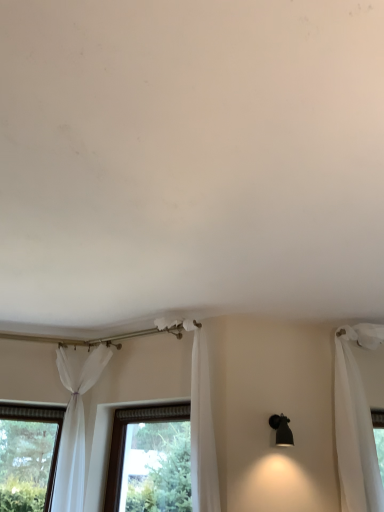
Question: Is white sheer curtain at center, positioned as the 1th curtain in right-to-left order, positioned with its back to sheer white curtain at lower left, which appears as the first curtain when viewed from the left?

Choices:
 (A) no
 (B) yes

Answer: (A)

Question: From a real-world perspective, is white sheer curtain at center, which is counted as the 2th curtain, starting from the left, positioned over sheer white curtain at lower left, arranged as the 2th curtain when viewed from the right, based on gravity?

Choices:
 (A) no
 (B) yes

Answer: (B)

Question: Is white sheer curtain at center, which is counted as the 2th curtain, starting from the left, shorter than sheer white curtain at lower left, which appears as the first curtain when viewed from the left?

Choices:
 (A) no
 (B) yes

Answer: (A)

Question: Is white sheer curtain at center, which is counted as the 2th curtain, starting from the left, aimed at sheer white curtain at lower left, which appears as the first curtain when viewed from the left?

Choices:
 (A) no
 (B) yes

Answer: (A)

Question: Does white sheer curtain at center, positioned as the 1th curtain in right-to-left order, appear on the right side of sheer white curtain at lower left, which appears as the first curtain when viewed from the left?

Choices:
 (A) no
 (B) yes

Answer: (B)

Question: In terms of width, does black matte wall sconce at right look wider or thinner when compared to white sheer curtain at center, positioned as the 1th curtain in right-to-left order?

Choices:
 (A) thin
 (B) wide

Answer: (A)

Question: Looking at the image, does black matte wall sconce at right seem bigger or smaller compared to white sheer curtain at center, which is counted as the 2th curtain, starting from the left?

Choices:
 (A) small
 (B) big

Answer: (A)

Question: From the image's perspective, is black matte wall sconce at right located above or below white sheer curtain at center, positioned as the 1th curtain in right-to-left order?

Choices:
 (A) below
 (B) above

Answer: (A)

Question: Is black matte wall sconce at right taller or shorter than white sheer curtain at center, positioned as the 1th curtain in right-to-left order?

Choices:
 (A) short
 (B) tall

Answer: (A)

Question: From a real-world perspective, is black matte wall sconce at right above or below clear glass window at center?

Choices:
 (A) above
 (B) below

Answer: (A)

Question: Is black matte wall sconce at right in front of or behind clear glass window at center in the image?

Choices:
 (A) behind
 (B) front

Answer: (B)

Question: In the image, is black matte wall sconce at right on the left side or the right side of clear glass window at center?

Choices:
 (A) left
 (B) right

Answer: (B)

Question: Is point (283, 417) closer or farther from the camera than point (115, 442)?

Choices:
 (A) closer
 (B) farther

Answer: (A)

Question: Is white sheer curtain at center, which is counted as the 2th curtain, starting from the left, inside the boundaries of clear glass window at center, or outside?

Choices:
 (A) inside
 (B) outside

Answer: (B)

Question: In the image, is white sheer curtain at center, positioned as the 1th curtain in right-to-left order, on the left side or the right side of clear glass window at center?

Choices:
 (A) right
 (B) left

Answer: (A)